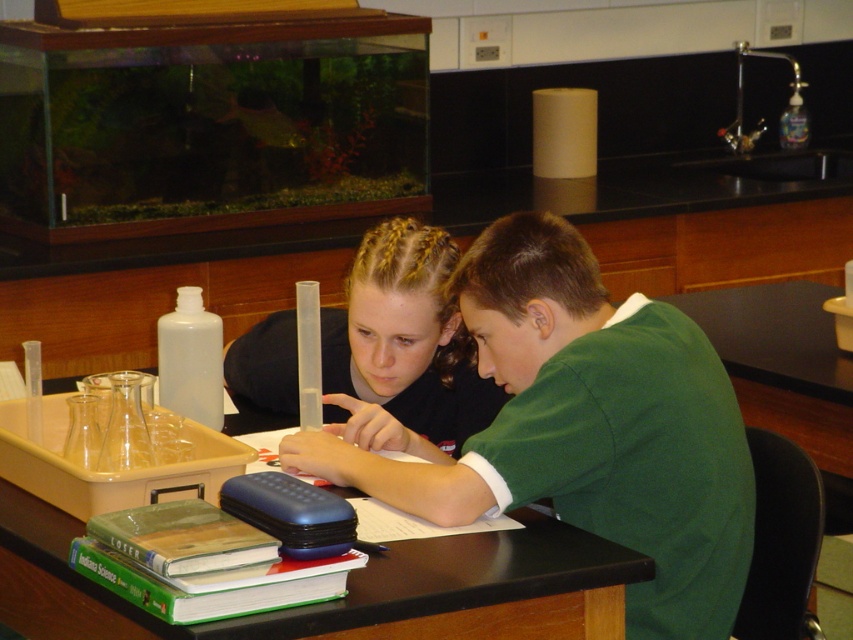
Does green matte shirt at center appear on the right side of black matte table at center?

Yes, green matte shirt at center is to the right of black matte table at center.

Between point (572, 440) and point (534, 536), which one is positioned behind?

Point (534, 536)

Find the location of `green matte shirt at center`. green matte shirt at center is located at coordinates (585, 428).

Where is `green matte shirt at center`? green matte shirt at center is located at coordinates (585, 428).

Does black matte table at center appear under smooth black shirt at center?

Yes, black matte table at center is below smooth black shirt at center.

Does black matte table at center have a smaller size compared to smooth black shirt at center?

No, black matte table at center is not smaller than smooth black shirt at center.

Find the location of a particular element. The image size is (853, 640). black matte table at center is located at coordinates (347, 586).

Who is shorter, green matte shirt at center or smooth black shirt at center?

smooth black shirt at center is shorter.

Is green matte shirt at center smaller than smooth black shirt at center?

No, green matte shirt at center is not smaller than smooth black shirt at center.

Measure the distance between point [509,280] and camera.

The distance of point [509,280] from camera is 5.43 feet.

Identify the location of green matte shirt at center. (585, 428).